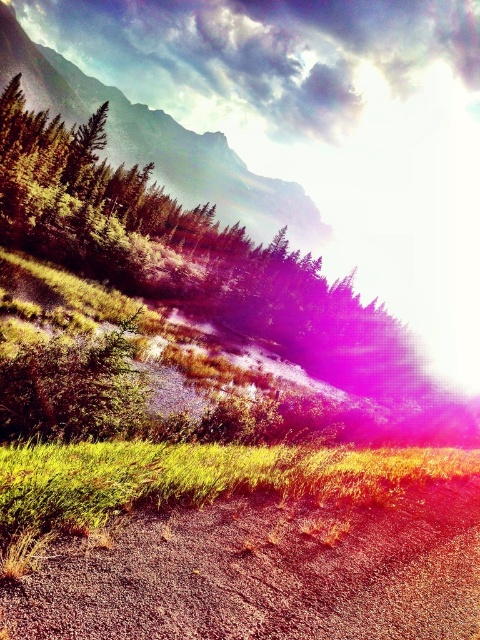
Is brown gravel dirt track at lower center smaller than green textured mountain at upper left?

Yes, brown gravel dirt track at lower center is smaller than green textured mountain at upper left.

This screenshot has width=480, height=640. What do you see at coordinates (265, 573) in the screenshot?
I see `brown gravel dirt track at lower center` at bounding box center [265, 573].

This screenshot has height=640, width=480. I want to click on brown gravel dirt track at lower center, so pyautogui.click(x=265, y=573).